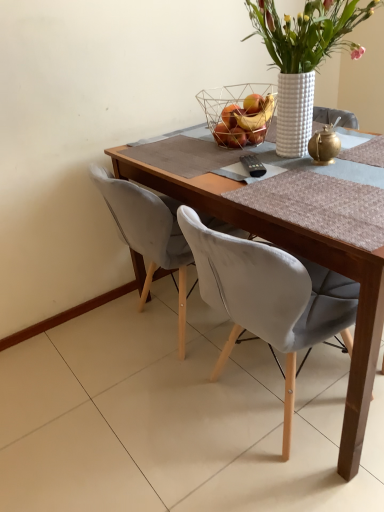
This screenshot has height=512, width=384. What are the coordinates of `vacant area situated to the left side of wire mesh basket at upper center` in the screenshot? It's located at (183, 147).